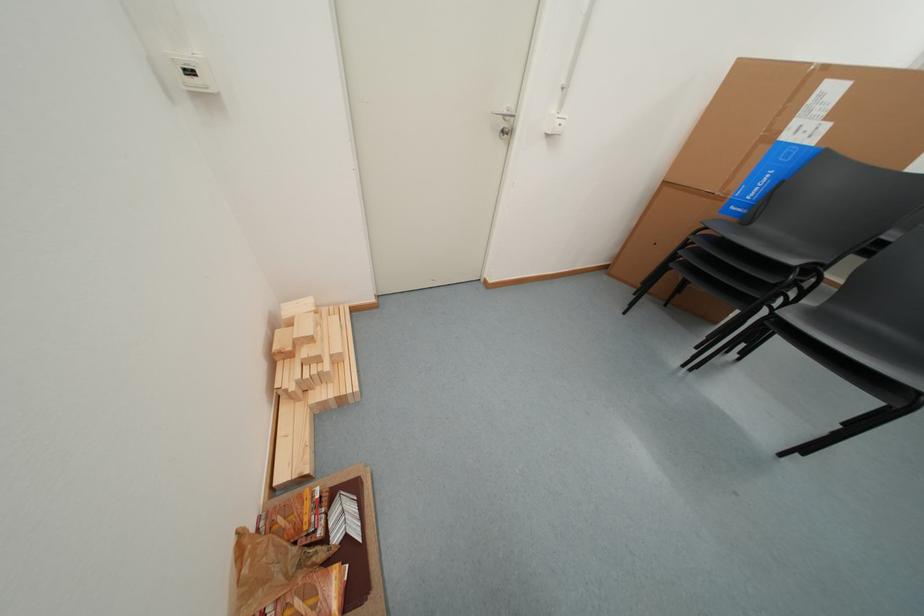
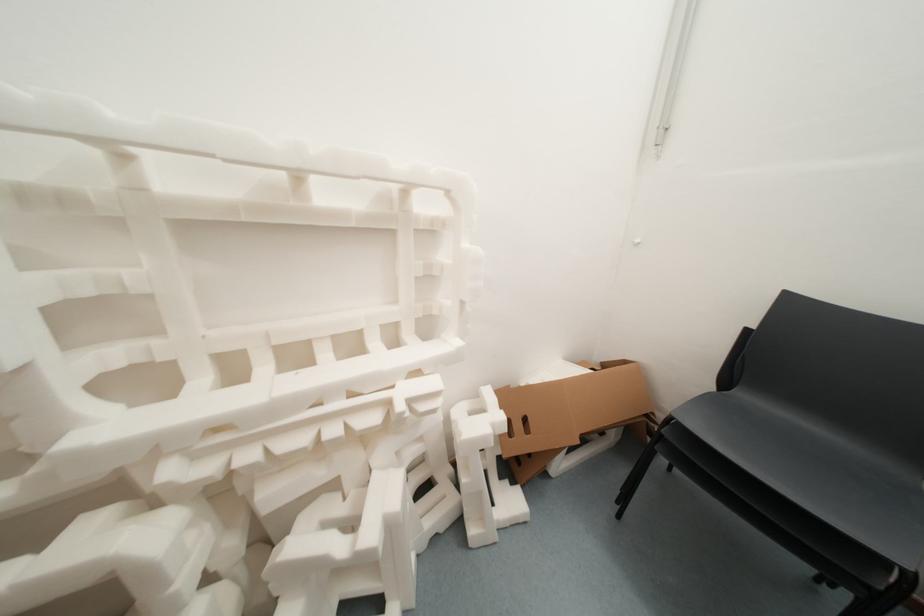
In a continuous first-person perspective shot, in which direction is the camera moving?

The cameraman walked toward right, forward.